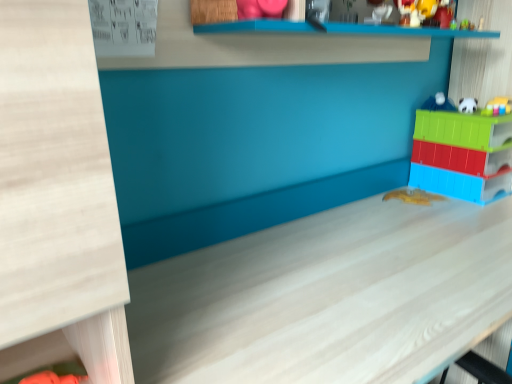
The width and height of the screenshot is (512, 384). In order to click on yellow plastic toy at center, placed as the first toy when sorted from bottom to top in this screenshot , I will do [x=413, y=196].

From a real-world perspective, which object stands above the other?

From a 3D spatial view, green plastic toy at upper right, the 3th toy positioned from the top, is above.

Is yellow plastic toy at center, placed as the first toy when sorted from bottom to top, looking in the opposite direction of green plastic toy at upper right, the 3th toy positioned from the top?

yellow plastic toy at center, placed as the first toy when sorted from bottom to top, is not turned away from green plastic toy at upper right, the 3th toy positioned from the top.

Is there a large distance between yellow plastic toy at center, placed as the first toy when sorted from bottom to top, and green plastic toy at upper right, positioned as the third toy in bottom-to-top order?

No, yellow plastic toy at center, placed as the first toy when sorted from bottom to top, is in close proximity to green plastic toy at upper right, positioned as the third toy in bottom-to-top order.

Which object is closer to the camera taking this photo, yellow plastic toy at center, arranged as the fifth toy when viewed from the top, or green plastic toy at upper right, positioned as the third toy in bottom-to-top order?

Positioned in front is green plastic toy at upper right, positioned as the third toy in bottom-to-top order.

Who is bigger, translucent plastic toy at right, the second toy from the bottom, or white matte table at center?

white matte table at center is bigger.

Is translucent plastic toy at right, which ranks as the 4th toy in top-to-bottom order, located outside white matte table at center?

Yes, translucent plastic toy at right, which ranks as the 4th toy in top-to-bottom order, is located beyond the bounds of white matte table at center.

Is translucent plastic toy at right, the second toy from the bottom, facing away from white matte table at center?

translucent plastic toy at right, the second toy from the bottom, does not have its back to white matte table at center.

Is translucent plastic toy at right, which ranks as the 4th toy in top-to-bottom order, far away from white matte table at center?

They are positioned close to each other.

Which of these two, white matte table at center or white glossy ball at upper right, which ranks as the 5th toy in bottom-to-top order, is bigger?

white matte table at center is bigger.

Considering the relative positions of white matte table at center and white glossy ball at upper right, which ranks as the first toy in top-to-bottom order, in the image provided, is white matte table at center to the left or to the right of white glossy ball at upper right, which ranks as the first toy in top-to-bottom order,?

white matte table at center is positioned on white glossy ball at upper right, which ranks as the first toy in top-to-bottom order,'s left side.

Based on the photo, is white matte table at center looking in the opposite direction of white glossy ball at upper right, which ranks as the first toy in top-to-bottom order?

white matte table at center does not have its back to white glossy ball at upper right, which ranks as the first toy in top-to-bottom order.

Looking at this image, does white matte table at center have a lesser width compared to white glossy ball at upper right, which ranks as the first toy in top-to-bottom order?

No.

Find the location of a particular element. toy that appears above the white plush toy at upper right, the 4th toy ordered from the bottom (from a real-world perspective) is located at coordinates (439, 103).

Considering the relative positions of white glossy ball at upper right, which ranks as the first toy in top-to-bottom order, and white plush toy at upper right, which appears as the 2th toy when viewed from the top, in the image provided, is white glossy ball at upper right, which ranks as the first toy in top-to-bottom order, in front of white plush toy at upper right, which appears as the 2th toy when viewed from the top,?

No, it is not.

Is white glossy ball at upper right, which ranks as the first toy in top-to-bottom order, wider than white plush toy at upper right, the 4th toy ordered from the bottom?

Correct, the width of white glossy ball at upper right, which ranks as the first toy in top-to-bottom order, exceeds that of white plush toy at upper right, the 4th toy ordered from the bottom.

Is point (507, 105) closer or farther from the camera than point (437, 197)?

Point (507, 105) is closer to the camera than point (437, 197).

Is green plastic toy at upper right, positioned as the third toy in bottom-to-top order, spatially inside yellow plastic toy at center, placed as the first toy when sorted from bottom to top, or outside of it?

green plastic toy at upper right, positioned as the third toy in bottom-to-top order, cannot be found inside yellow plastic toy at center, placed as the first toy when sorted from bottom to top.

Considering the sizes of green plastic toy at upper right, positioned as the third toy in bottom-to-top order, and yellow plastic toy at center, placed as the first toy when sorted from bottom to top, in the image, is green plastic toy at upper right, positioned as the third toy in bottom-to-top order, taller or shorter than yellow plastic toy at center, placed as the first toy when sorted from bottom to top,?

green plastic toy at upper right, positioned as the third toy in bottom-to-top order, is taller than yellow plastic toy at center, placed as the first toy when sorted from bottom to top.

Is white glossy ball at upper right, which ranks as the first toy in top-to-bottom order, placed right next to yellow plastic toy at center, arranged as the fifth toy when viewed from the top?

They are not placed beside each other.

Measure the distance from white glossy ball at upper right, which ranks as the first toy in top-to-bottom order, to yellow plastic toy at center, placed as the first toy when sorted from bottom to top.

white glossy ball at upper right, which ranks as the first toy in top-to-bottom order, is 11.17 inches away from yellow plastic toy at center, placed as the first toy when sorted from bottom to top.

Based on the photo, from the image's perspective, which object appears higher, white glossy ball at upper right, which ranks as the 5th toy in bottom-to-top order, or yellow plastic toy at center, arranged as the fifth toy when viewed from the top?

white glossy ball at upper right, which ranks as the 5th toy in bottom-to-top order, from the image's perspective.

From a real-world perspective, is white plush toy at upper right, which appears as the 2th toy when viewed from the top, over yellow plastic toy at center, placed as the first toy when sorted from bottom to top?

Yes.

Between white plush toy at upper right, which appears as the 2th toy when viewed from the top, and yellow plastic toy at center, placed as the first toy when sorted from bottom to top, which one is positioned in front?

white plush toy at upper right, which appears as the 2th toy when viewed from the top, is closer to the camera.

Is yellow plastic toy at center, arranged as the fifth toy when viewed from the top, completely or partially inside white plush toy at upper right, the 4th toy ordered from the bottom?

No, yellow plastic toy at center, arranged as the fifth toy when viewed from the top, is not a part of white plush toy at upper right, the 4th toy ordered from the bottom.

From the yellow plastic toy at center, arranged as the fifth toy when viewed from the top, count 2nd toys forward and point to it. Please provide its 2D coordinates.

[(497, 107)]

This screenshot has height=384, width=512. Identify the location of table below the translucent plastic toy at right, the second toy from the bottom (from a real-world perspective). (327, 297).

Based on their spatial positions, is green plastic toy at upper right, the 3th toy positioned from the top, or white glossy ball at upper right, which ranks as the first toy in top-to-bottom order, further from white matte table at center?

white glossy ball at upper right, which ranks as the first toy in top-to-bottom order, lies further to white matte table at center than the other object.

When comparing their distances from translucent plastic toy at right, the second toy from the bottom, does green plastic toy at upper right, the 3th toy positioned from the top, or white glossy ball at upper right, which ranks as the 5th toy in bottom-to-top order, seem further?

Among the two, green plastic toy at upper right, the 3th toy positioned from the top, is located further to translucent plastic toy at right, the second toy from the bottom.

Based on their spatial positions, is translucent plastic toy at right, which ranks as the 4th toy in top-to-bottom order, or white glossy ball at upper right, which ranks as the 5th toy in bottom-to-top order, closer to white matte table at center?

translucent plastic toy at right, which ranks as the 4th toy in top-to-bottom order, lies closer to white matte table at center than the other object.

Looking at the image, which one is located further to white matte table at center, white plush toy at upper right, which appears as the 2th toy when viewed from the top, or translucent plastic toy at right, which ranks as the 4th toy in top-to-bottom order?

white plush toy at upper right, which appears as the 2th toy when viewed from the top, lies further to white matte table at center than the other object.

Estimate the real-world distances between objects in this image. Which object is closer to white glossy ball at upper right, which ranks as the 5th toy in bottom-to-top order, white plush toy at upper right, the 4th toy ordered from the bottom, or green plastic toy at upper right, the 3th toy positioned from the top?

white plush toy at upper right, the 4th toy ordered from the bottom.

Looking at the image, which one is located further to white matte table at center, green plastic toy at upper right, positioned as the third toy in bottom-to-top order, or white plush toy at upper right, the 4th toy ordered from the bottom?

white plush toy at upper right, the 4th toy ordered from the bottom.

Estimate the real-world distances between objects in this image. Which object is further from white plush toy at upper right, which appears as the 2th toy when viewed from the top, white glossy ball at upper right, which ranks as the first toy in top-to-bottom order, or green plastic toy at upper right, the 3th toy positioned from the top?

white glossy ball at upper right, which ranks as the first toy in top-to-bottom order.

Consider the image. Based on their spatial positions, is translucent plastic toy at right, the second toy from the bottom, or green plastic toy at upper right, the 3th toy positioned from the top, further from white matte table at center?

green plastic toy at upper right, the 3th toy positioned from the top, is further to white matte table at center.

What are the coordinates of `toy between white plush toy at upper right, the 4th toy ordered from the bottom, and translucent plastic toy at right, which ranks as the 4th toy in top-to-bottom order, in the vertical direction` in the screenshot? It's located at (497, 107).

I want to click on toy between white matte table at center and green plastic toy at upper right, the 3th toy positioned from the top, from front to back, so click(x=462, y=155).

You are a GUI agent. You are given a task and a screenshot of the screen. Output one action in this format:
    pyautogui.click(x=<x>, y=<y>)
    Task: Click on the toy between green plastic toy at upper right, the 3th toy positioned from the top, and yellow plastic toy at center, placed as the first toy when sorted from bottom to top, vertically
    
    Given the screenshot: What is the action you would take?
    pyautogui.click(x=462, y=155)